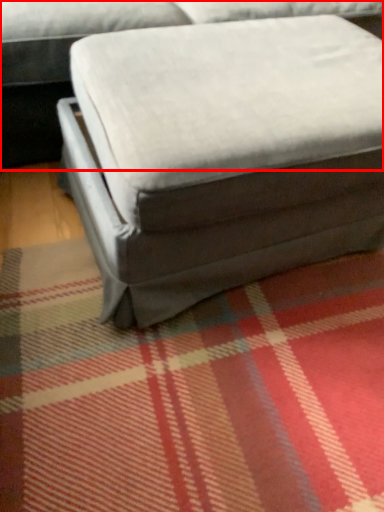
Question: From the image's perspective, where is studio couch (annotated by the red box) located in relation to bean bag chair in the image?

Choices:
 (A) below
 (B) above

Answer: (B)